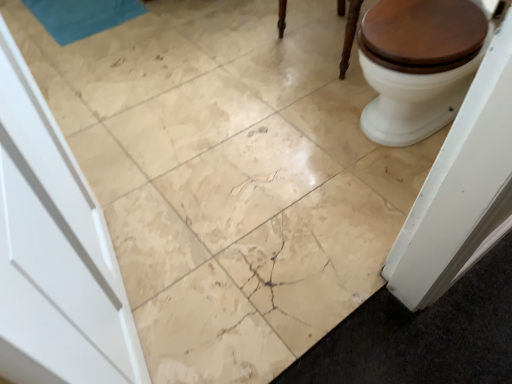
What do you see at coordinates (418, 65) in the screenshot?
I see `white glossy toilet at upper right` at bounding box center [418, 65].

You are a GUI agent. You are given a task and a screenshot of the screen. Output one action in this format:
    pyautogui.click(x=<x>, y=<y>)
    Task: Click on the white glossy toilet at upper right
    Image resolution: width=512 pixels, height=384 pixels.
    Given the screenshot: What is the action you would take?
    pyautogui.click(x=418, y=65)

Locate an element on the screen. white glossy toilet at upper right is located at coordinates (418, 65).